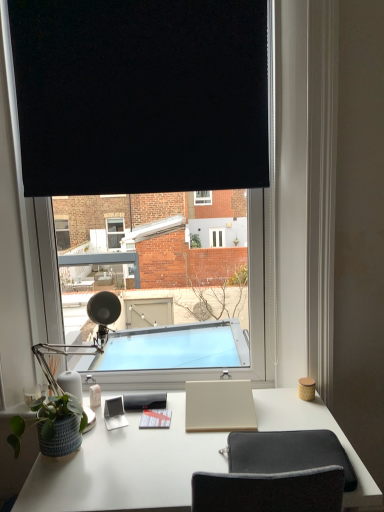
Locate an element on the screen. vacant space situated above dark gray fabric computer chair at lower center (from a real-world perspective) is located at coordinates pyautogui.click(x=281, y=441).